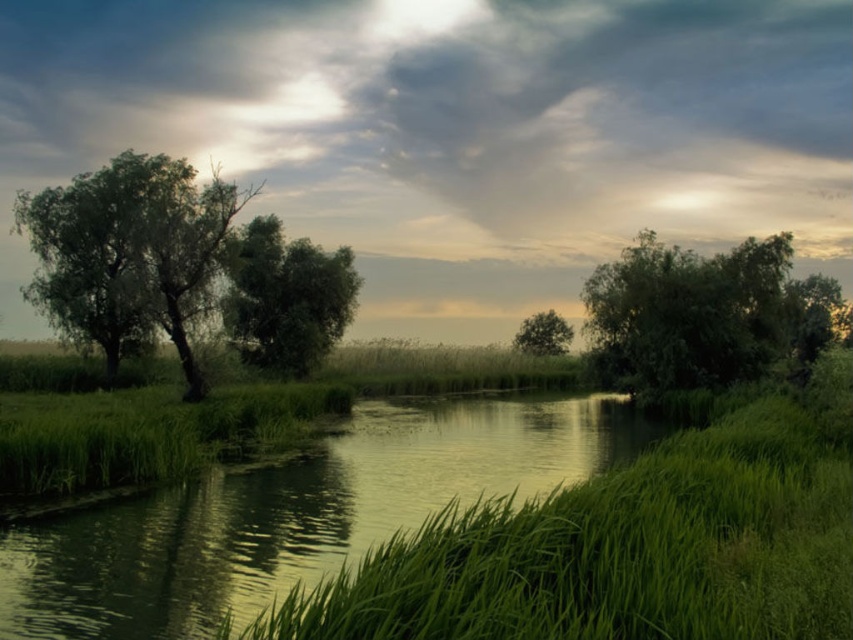
You are standing at the edge of the waterway and notice the green grass at center and the green leafy tree at right. From your position, which object is positioned to the left?

The green grass at center is positioned to the left of the green leafy tree at right.

You are a bird flying over the waterway and want to land on the green grass at center. Can you safely descend from the cloudy sky at upper center without hitting any obstacles?

The cloudy sky at upper center is much taller than the green grass at center, so yes, you can safely descend from the cloudy sky at upper center to the green grass at center without hitting any obstacles.

You are a hiker standing at the edge of the waterway. You need to cross to the other side. The green grass at center and the green leafy tree at right are in your path. Which object is narrower and can be easily navigated around?

The green grass at center is thinner than the green leafy tree at right, so the green grass at center is narrower and can be easily navigated around.